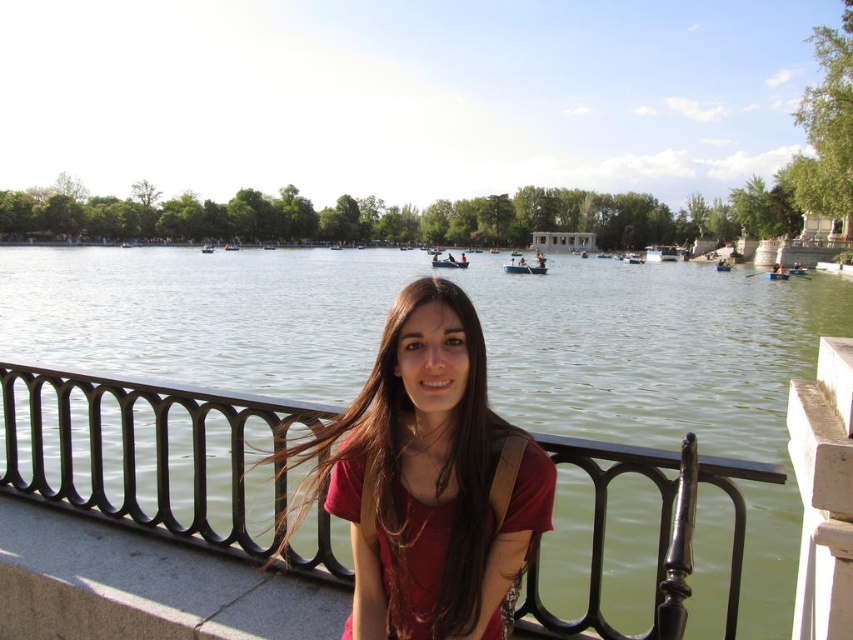
You are a photographer trying to capture a clear shot of the matte red shirt at center without the black metal railing at center obstructing the view. Is this possible based on their positions?

The black metal railing at center is in front of the matte red shirt at center, so it would obstruct the view of the shirt. To capture a clear shot, you would need to move around the railing or adjust your angle to avoid it.